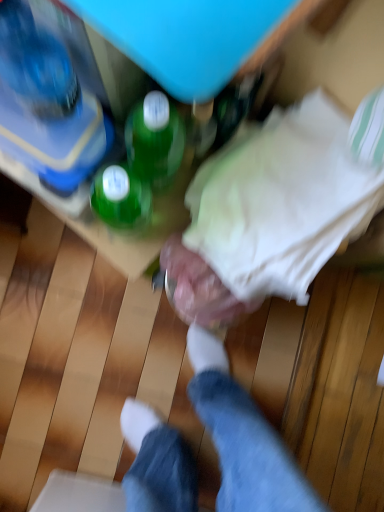
Question: Does metallic silver dumbbell at center turn towards white fabric at center?

Choices:
 (A) no
 (B) yes

Answer: (A)

Question: From a real-world perspective, is metallic silver dumbbell at center over white fabric at center?

Choices:
 (A) yes
 (B) no

Answer: (B)

Question: Is metallic silver dumbbell at center at the right side of white fabric at center?

Choices:
 (A) yes
 (B) no

Answer: (B)

Question: Is metallic silver dumbbell at center positioned in front of white fabric at center?

Choices:
 (A) no
 (B) yes

Answer: (A)

Question: Is metallic silver dumbbell at center positioned behind white fabric at center?

Choices:
 (A) yes
 (B) no

Answer: (A)

Question: From the image's perspective, relative to white fabric at center, is translucent plastic bottle at upper left above or below?

Choices:
 (A) above
 (B) below

Answer: (A)

Question: Is point (23, 162) positioned closer to the camera than point (240, 206)?

Choices:
 (A) closer
 (B) farther

Answer: (B)

Question: Is translucent plastic bottle at upper left inside the boundaries of white fabric at center, or outside?

Choices:
 (A) inside
 (B) outside

Answer: (B)

Question: From a real-world perspective, is translucent plastic bottle at upper left physically located above or below white fabric at center?

Choices:
 (A) above
 (B) below

Answer: (A)

Question: Considering the positions of green glass bottle at upper center and translucent plastic bottle at upper left in the image, is green glass bottle at upper center wider or thinner than translucent plastic bottle at upper left?

Choices:
 (A) wide
 (B) thin

Answer: (B)

Question: From the image's perspective, is green glass bottle at upper center positioned above or below translucent plastic bottle at upper left?

Choices:
 (A) above
 (B) below

Answer: (B)

Question: Is green glass bottle at upper center bigger or smaller than translucent plastic bottle at upper left?

Choices:
 (A) small
 (B) big

Answer: (B)

Question: Would you say green glass bottle at upper center is inside or outside translucent plastic bottle at upper left?

Choices:
 (A) inside
 (B) outside

Answer: (B)

Question: From a real-world perspective, relative to metallic silver dumbbell at center, is white fabric at center vertically above or below?

Choices:
 (A) above
 (B) below

Answer: (A)

Question: Is white fabric at center wider or thinner than metallic silver dumbbell at center?

Choices:
 (A) thin
 (B) wide

Answer: (B)